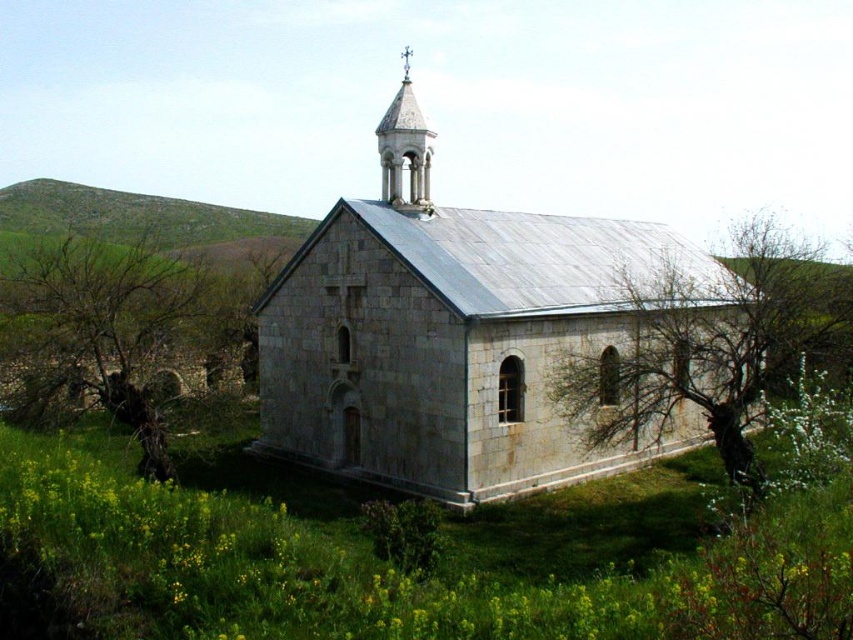
Looking at this image, you are standing at the entrance of the village square, which is at coordinates point 0.5, 0.5. You want to go to the gray stone church at center. Which direction should you walk to reach it?

The gray stone church at center is located at point (469, 344), which is slightly northeast of your current position at (426, 320). You should walk in a northeast direction to reach it.

You are standing in front of the stone church and notice a brown rough tree at lower left and bare branches at right. Which object is closer to you?

The brown rough tree at lower left is closer to you because the bare branches at right is behind it.

Based on the photo, you are standing in front of the church and see two points marked on the image. The first point is at coordinate point (498, 429) and the second is at point (131, 330). Which point is closer to you?

Point (498, 429) is further to the viewer than point (131, 330), so the second point at (131, 330) is closer to you.